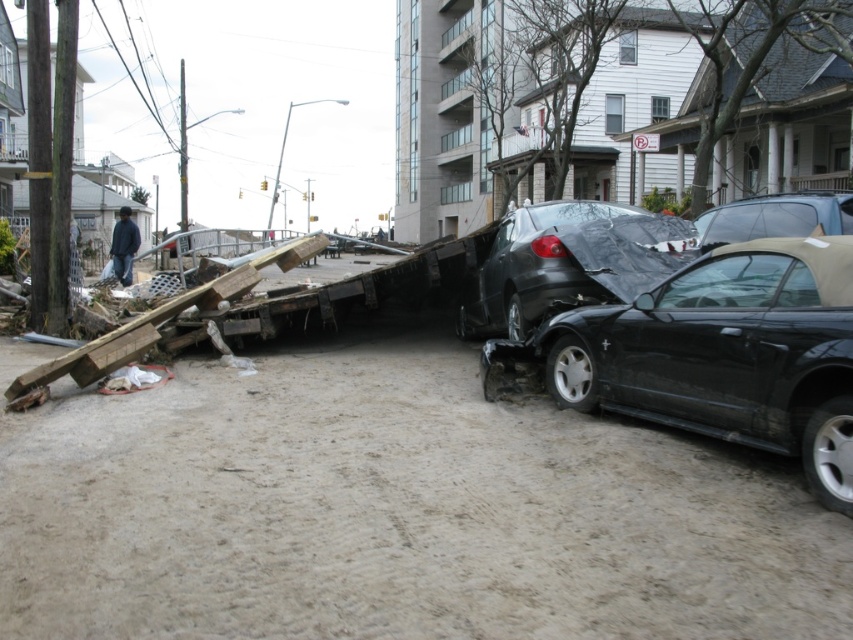
Where is the black matte car at center located in the image?

The black matte car at center is located at point [567,262] in the image.

You are a rescue worker trying to reach a survivor trapped under the collapsed structure. You must navigate around the vehicles. Which vehicle should you go around first, the black matte car at center or the matte black convertible at center, based on their positions?

The black matte car at center is located below the matte black convertible at center, so you should go around the matte black convertible at center first to reach the collapsed structure.